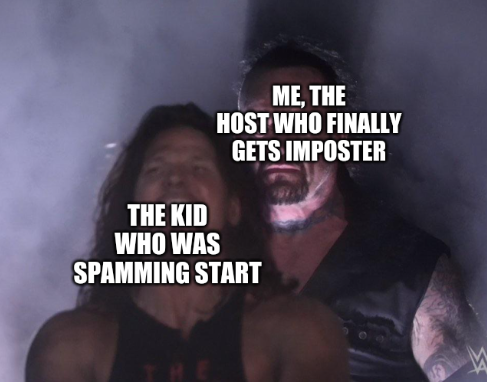
Where is `spotlight`? spotlight is located at coordinates (46, 194).